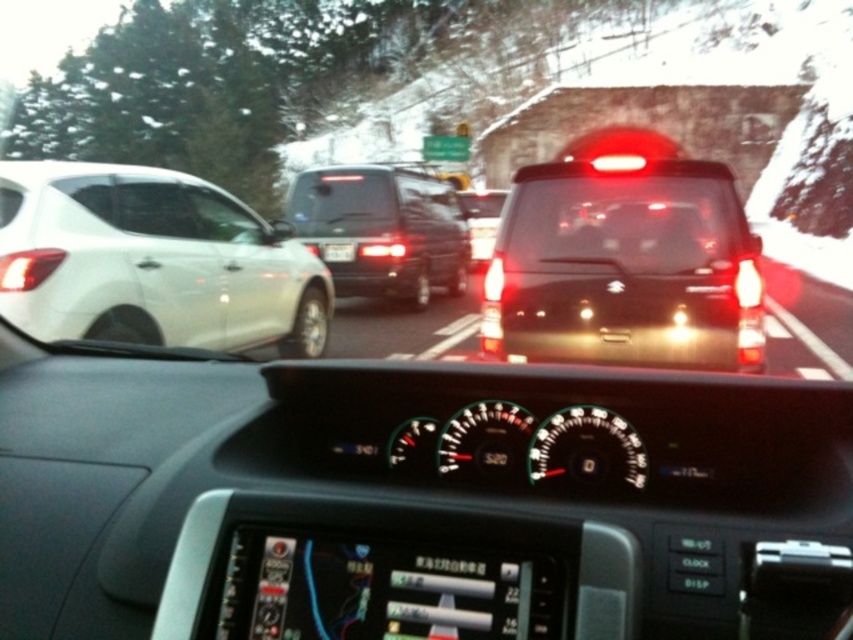
You are driving a car and notice the white glossy hatchback at left and the transparent glass windshield at center. Which object is closer to you, the driver?

The white glossy hatchback at left is closer to you than the transparent glass windshield at center because it is positioned below it, indicating it is further away in the scene.

You are driving a car and want to know if you can see the entire black matte suv at center through the transparent glass windshield at center. Based on their heights, can you see the entire suv?

The black matte suv at center has a greater height compared to transparent glass windshield at center. Therefore, you cannot see the entire black matte suv at center through the transparent glass windshield at center because the suv is taller than the windshield.

You are driving in a snowstorm and need to determine if your vehicle can safely pass between the black matte suv at center and the transparent glass windshield at center. Can you fit through the space between them?

The black matte suv at center has a lesser width compared to transparent glass windshield at center, so there might be enough space to pass through, but since the vehicle is stationary and in a snowstorm, it is advisable to proceed with caution or wait for better visibility.